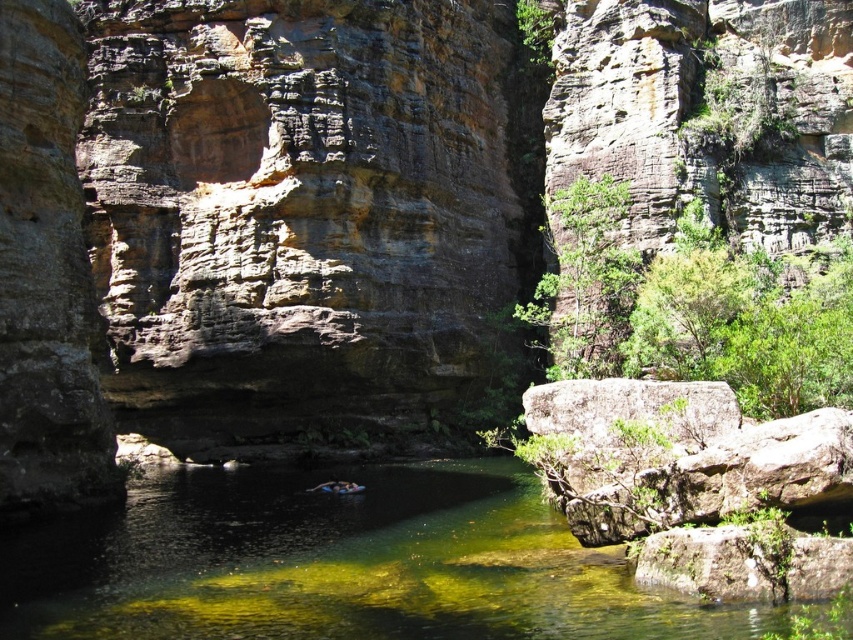
You are planning to jump into the clear water at center and want to avoid the blue rubber ring at center. Based on the scene description, which object is wider so you can aim for the wider one to avoid the ring?

The clear water at center is wider than the blue rubber ring at center, so you should aim for the clear water at center to avoid the ring.